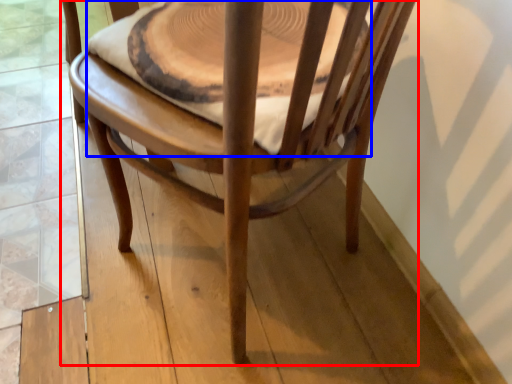
Question: Which object appears closest to the camera in this image, chair (highlighted by a red box) or round table (highlighted by a blue box)?

Choices:
 (A) chair
 (B) round table

Answer: (A)